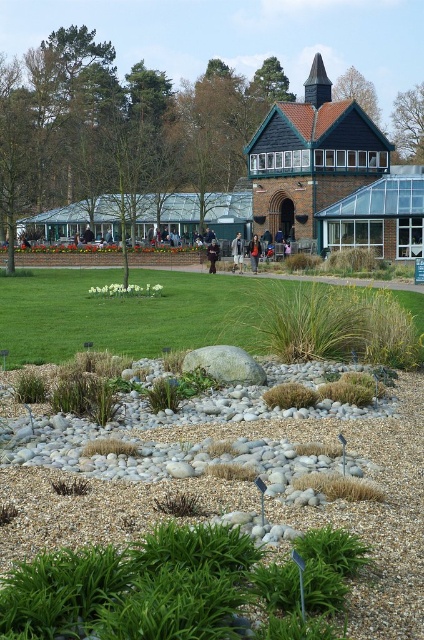
Based on the photo, is gray pebbles at center smaller than green grass at center?

Indeed, gray pebbles at center has a smaller size compared to green grass at center.

Is point (409, 605) farther from camera compared to point (402, 296)?

No, it is not.

Where is `gray pebbles at center`? The width and height of the screenshot is (424, 640). gray pebbles at center is located at coordinates (359, 502).

Can you confirm if green grass at center is shorter than dark brown leather jacket at center?

In fact, green grass at center may be taller than dark brown leather jacket at center.

Between green grass at center and dark brown leather jacket at center, which one has more height?

green grass at center is taller.

In order to click on green grass at center in this screenshot , I will do `click(133, 314)`.

Between light brown leather jacket at center and dark brown leather jacket at center, which one has more height?

light brown leather jacket at center is taller.

Is light brown leather jacket at center behind dark brown leather jacket at center?

Yes, light brown leather jacket at center is further from the viewer.

Does point (234, 244) come closer to viewer compared to point (256, 256)?

No, it is behind (256, 256).

Image resolution: width=424 pixels, height=640 pixels. Identify the location of light brown leather jacket at center. (237, 252).